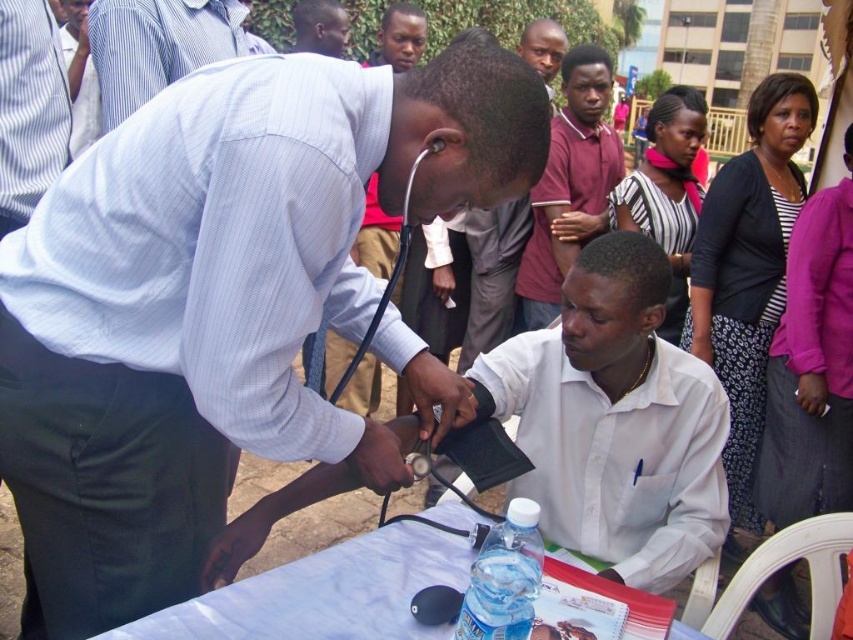
You are a photographer at a community health fair. You need to capture a photo of both the matte white shirt at center and the matte red shirt at center. The camera frame can only fit one of the shirts fully. Which shirt should you focus on to ensure it fits within the frame?

The matte white shirt at center has a larger width than the matte red shirt at center. Therefore, you should focus on the matte red shirt at center to ensure it fits within the camera frame.

You are standing at point (579, 74) and want to walk to point (262, 292). Is there a clear path between these two points without needing to go around any obstacles?

Yes, since point (262, 292) is in front of point (579, 74), there is a clear path between them without needing to go around obstacles.